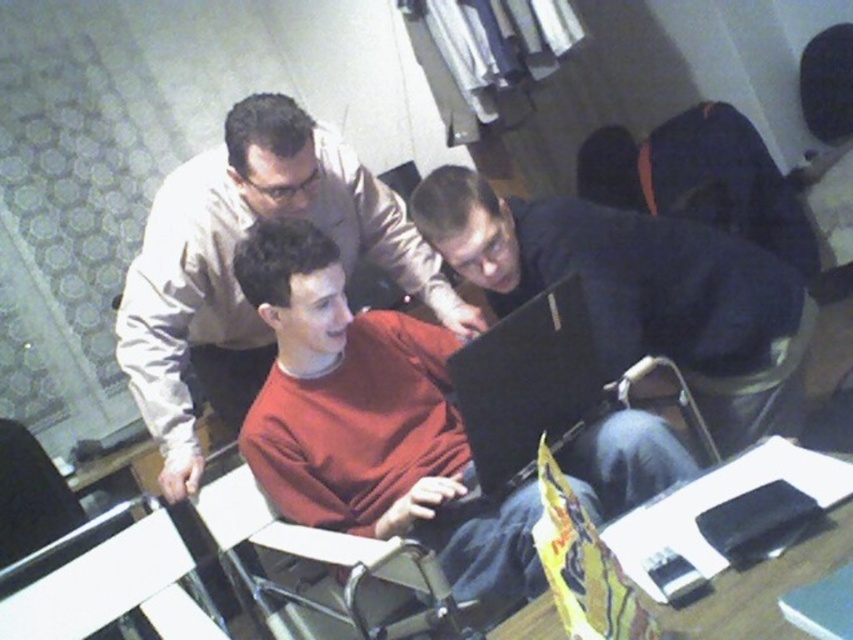
You are a photographer positioned at the camera. You want to capture a closeup shot of the matte red sweater at center. Given that your camera can focus on objects within a 4 feet range, will you be able to take the closeup without moving closer?

The matte red sweater at center is 4.52 feet away from the camera. Since the camera can focus within 4 feet, the sweater is slightly out of the focus range. You would need to move closer to ensure it is within the 4 feet limit.

You are trying to find the metallic silver chair at center in the image. According to the coordinates provided, where exactly is it located?

The metallic silver chair at center is located at coordinates point (x=312, y=552).

You are a person standing at the entrance of the room. You need to hand a document to the person wearing the matte beige shirt at center. The brown leather chair at lower right is blocking your path. Can you reach the person without moving the chair?

The matte beige shirt at center is in front of the brown leather chair at lower right, so you can reach the person without moving the chair because the shirt is already positioned in front of the chair.